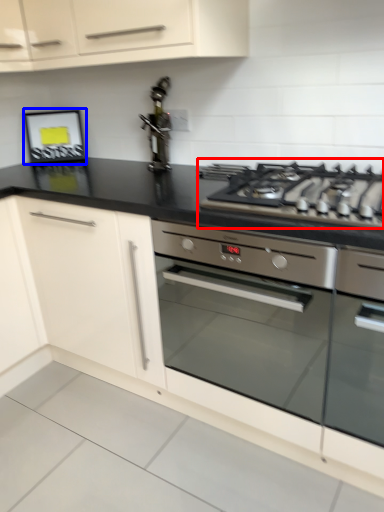
Question: Which object is further to the camera taking this photo, gas stove (highlighted by a red box) or picture frame (highlighted by a blue box)?

Choices:
 (A) gas stove
 (B) picture frame

Answer: (B)